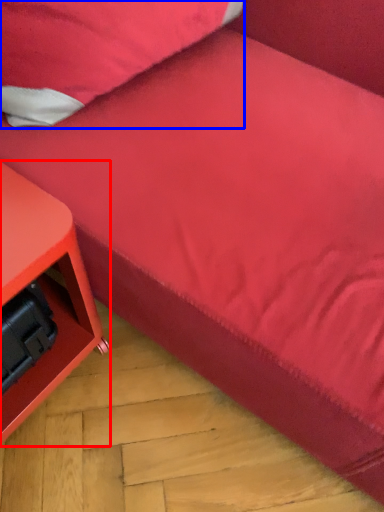
Question: Which point is closer to the camera, furniture (highlighted by a red box) or pillow (highlighted by a blue box)?

Choices:
 (A) furniture
 (B) pillow

Answer: (A)